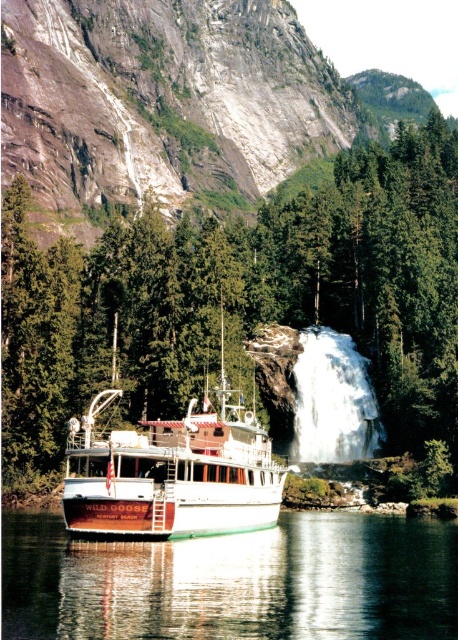
You are a photographer planning to capture a wide shot of the white matte cruise ship at center. However, you notice a green textured tree at center in the way. Can the cruise ship be fully visible in your photo without any obstruction from the tree?

The green textured tree at center might be wider than the white matte cruise ship at center, so there is a possibility that the tree could obstruct the view of the cruise ship. To ensure full visibility, you may need to adjust your position or angle to avoid the tree.

You are standing on the dock near the boat named Wild Goose. You see the green reflective water at lower center and the white matte cruise ship at center. How far apart are these two objects?

The green reflective water at lower center is 20.68 feet away from the white matte cruise ship at center.